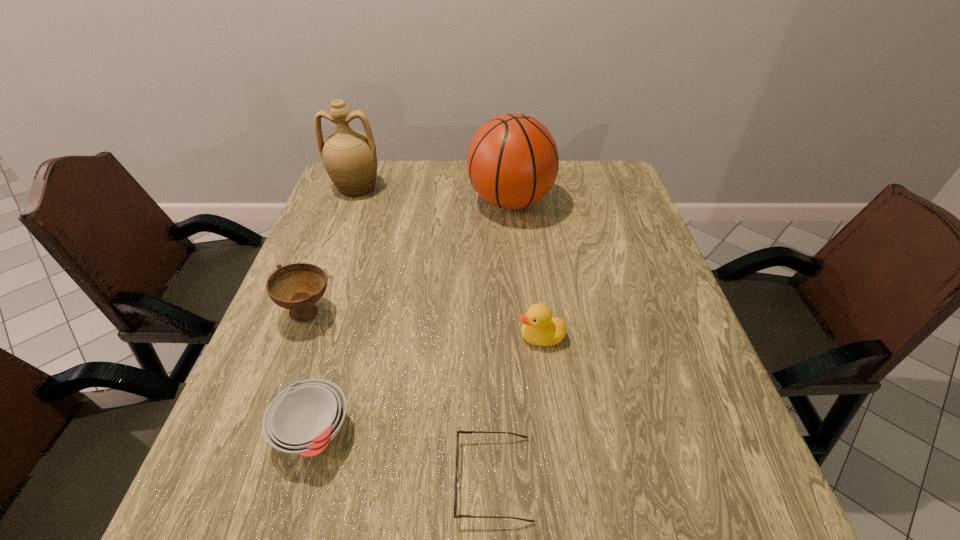
Locate an element on the screen. vacant space that satisfies the following two spatial constraints: 1. on the back side of the pitcher; 2. on the right side of the taller soup bowl is located at coordinates (354, 187).

Locate an element on the screen. The height and width of the screenshot is (540, 960). blank area in the image that satisfies the following two spatial constraints: 1. on the front side of the pitcher; 2. on the left side of the shorter soup bowl is located at coordinates click(267, 432).